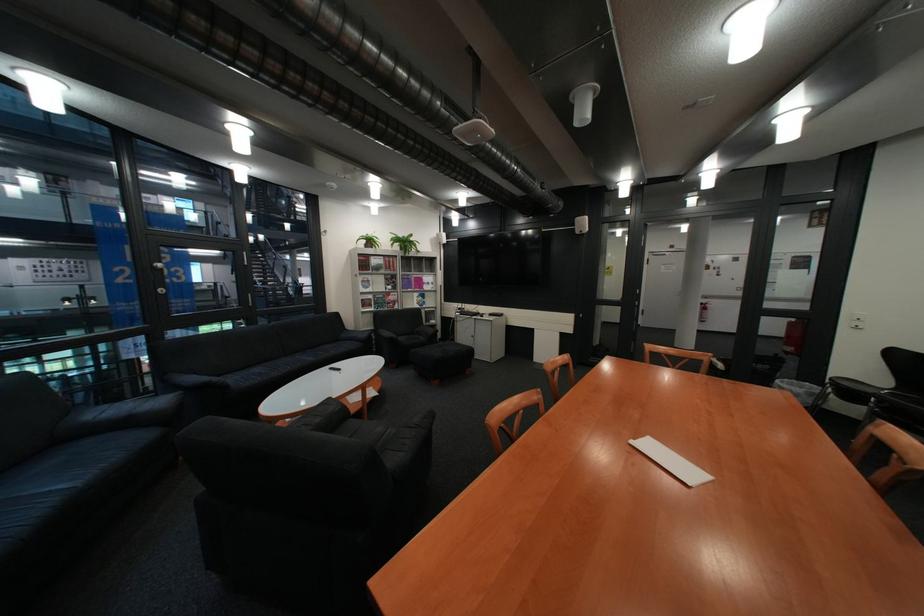
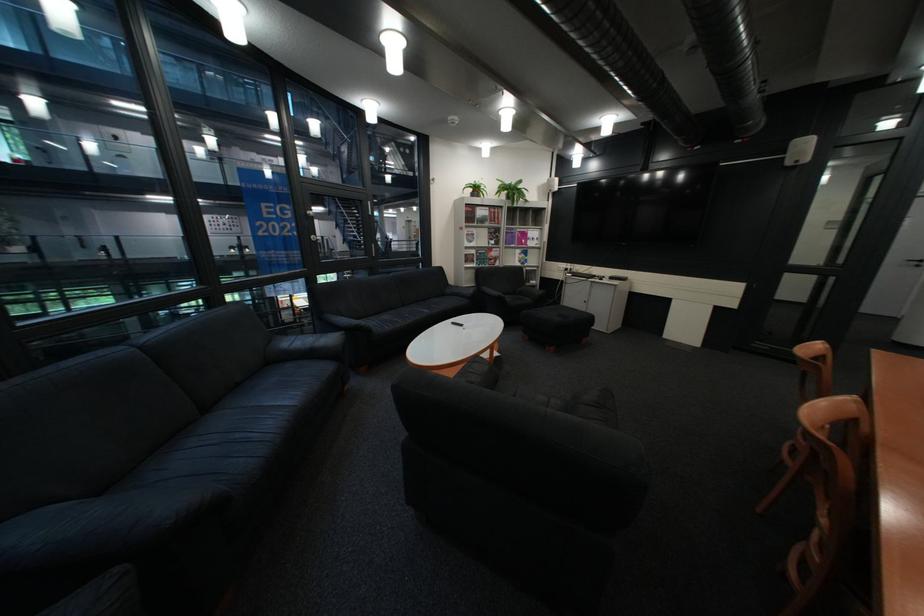
Where in the second image is the point corresponding to (x=400, y=278) from the first image?

(505, 233)